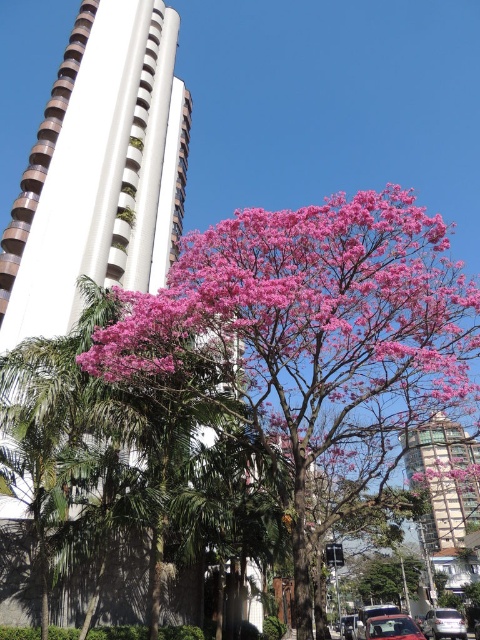
You are a photographer planning to capture a wide shot of the metallic glass building at right and the white glossy car at lower right. Based on their sizes, which object should you position closer to the camera to ensure both fit within the frame?

The metallic glass building at right is wider than the white glossy car at lower right. To ensure both fit in the frame, position the white glossy car at lower right closer to the camera since it is narrower and requires less space.

You are a photographer trying to capture a wide shot of the pink matte flower at center and the white glossy car at lower right. Which object is wider so that it can fill more of the frame?

The pink matte flower at center is wider than the white glossy car at lower right, so it will fill more of the frame.

You are a photographer trying to capture the pink matte flower at center and the shiny red car at center in the same frame. Based on their sizes, which object should you focus on to ensure both are clearly visible in your photo?

The pink matte flower at center is larger than the shiny red car at center, so focusing on the pink matte flower at center would ensure both are clearly visible as the flower takes up more space in the frame.